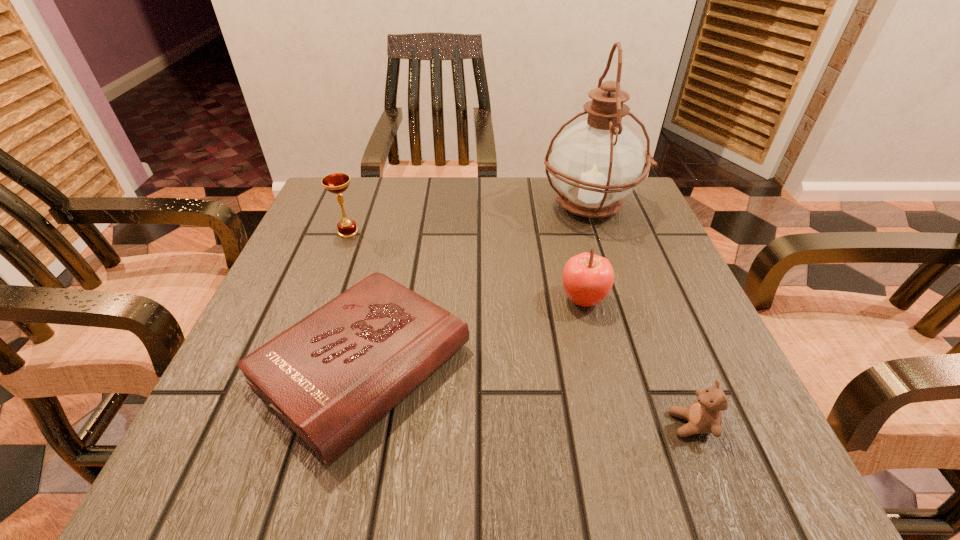
Where is `the tallest object`? The height and width of the screenshot is (540, 960). the tallest object is located at coordinates (596, 163).

The height and width of the screenshot is (540, 960). Identify the location of the fourth shortest object. (336, 183).

This screenshot has width=960, height=540. What are the coordinates of `apple` in the screenshot? It's located at (587, 278).

Where is `teddy bear`? teddy bear is located at coordinates (704, 416).

You are a GUI agent. You are given a task and a screenshot of the screen. Output one action in this format:
    pyautogui.click(x=<x>, y=<y>)
    Task: Click on the hardback book
    
    Given the screenshot: What is the action you would take?
    pyautogui.click(x=331, y=376)

Where is `vacant space located 0.390m on the front of the tallest object`? vacant space located 0.390m on the front of the tallest object is located at coordinates (652, 387).

Image resolution: width=960 pixels, height=540 pixels. What are the coordinates of `vacant area situated on the right of the chalice` in the screenshot? It's located at (397, 232).

Where is `vacant space situated 0.060m on the left of the third tallest object`? vacant space situated 0.060m on the left of the third tallest object is located at coordinates (527, 300).

Locate an element on the screen. Image resolution: width=960 pixels, height=540 pixels. vacant position located on the front-facing side of the teddy bear is located at coordinates (433, 424).

The image size is (960, 540). I want to click on free space located 0.360m on the front-facing side of the teddy bear, so click(x=420, y=424).